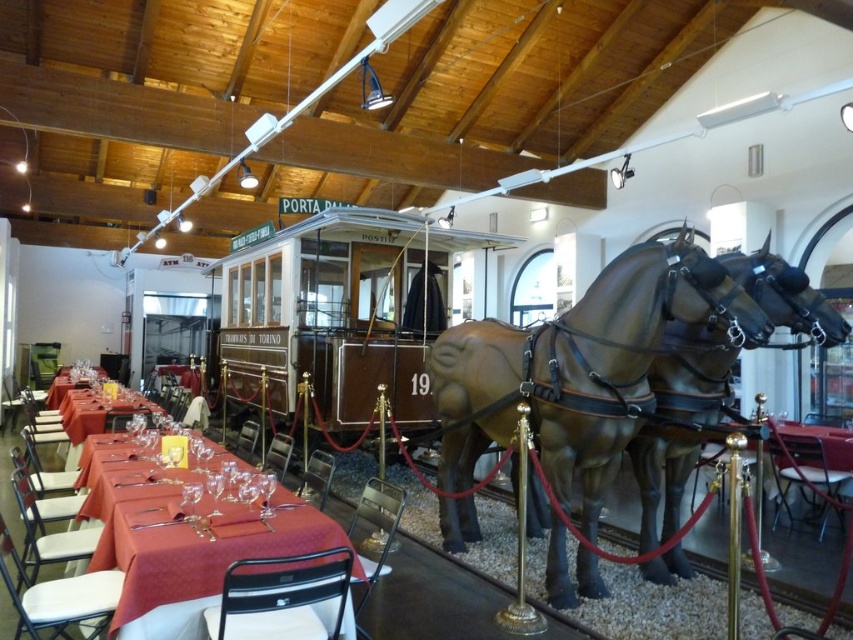
You are a guest at the themed restaurant and want to know if you can place a tall vase on the matte red tablecloth at left without it touching the brown polished wood train car at center. Can you confirm if there is enough vertical space between them?

The brown polished wood train car at center is much taller than the matte red tablecloth at left. Therefore, placing a tall vase on the matte red tablecloth at left would not risk it touching the train car since the tablecloth area is shorter in height compared to the train car.